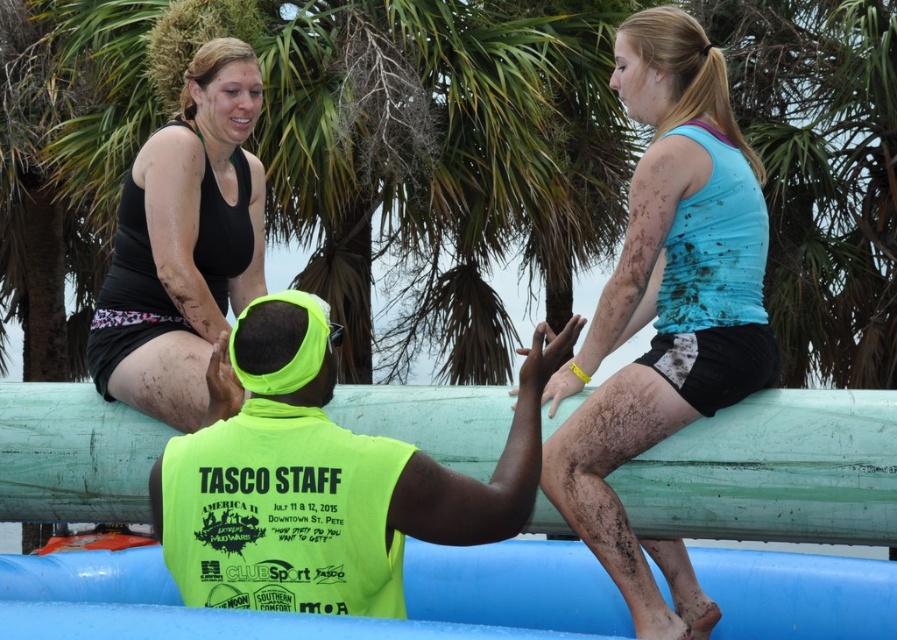
This screenshot has height=640, width=897. Find the location of `neon yellow vest at center`. neon yellow vest at center is located at coordinates (321, 477).

Between neon yellow vest at center and matte black tank top at upper left, which one is positioned higher?

matte black tank top at upper left

Consider the image. Who is more forward, (279, 385) or (236, 209)?

Point (279, 385) is more forward.

Locate an element on the screen. neon yellow vest at center is located at coordinates pos(321,477).

Is neon yellow fabric safety vest at center thinner than matte black tank top at upper left?

Incorrect, neon yellow fabric safety vest at center's width is not less than matte black tank top at upper left's.

Is point (325, 547) farther from viewer compared to point (251, 157)?

No.

Is point (208, 600) less distant than point (213, 100)?

Yes, point (208, 600) is in front of point (213, 100).

Locate an element on the screen. neon yellow fabric safety vest at center is located at coordinates (282, 515).

Based on the photo, who is more distant from viewer, (616, 419) or (529, 452)?

Point (616, 419)

Can you confirm if blue matte tank top at upper right is positioned below neon yellow vest at center?

No.

I want to click on blue matte tank top at upper right, so click(666, 308).